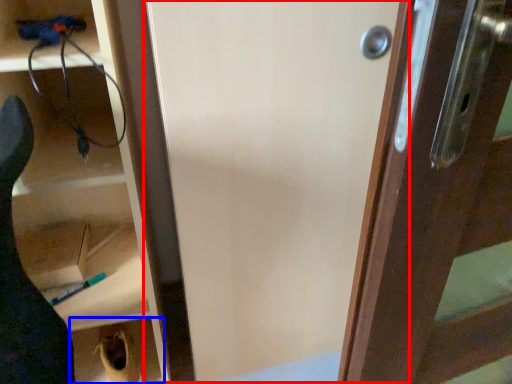
Question: Which object appears farthest to the camera in this image, screen door (highlighted by a red box) or cabinetry (highlighted by a blue box)?

Choices:
 (A) screen door
 (B) cabinetry

Answer: (B)